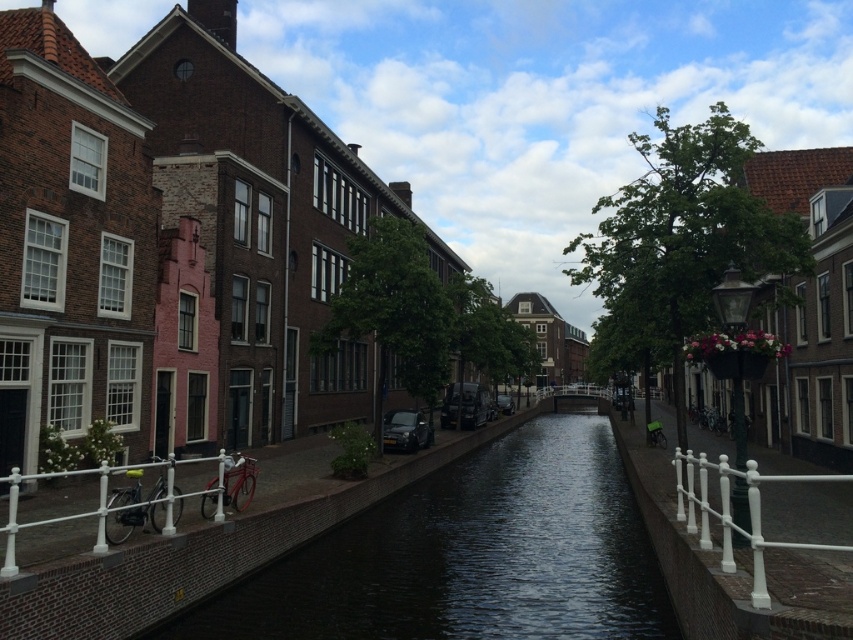
Question: Does white metal railing at lower right have a larger size compared to metallic bicycle at lower left?

Choices:
 (A) no
 (B) yes

Answer: (B)

Question: Among these points, which one is farthest from the camera?

Choices:
 (A) (701, 534)
 (B) (93, 509)

Answer: (B)

Question: Does white metal railing at lower right appear under metallic bicycle at lower left?

Choices:
 (A) yes
 (B) no

Answer: (A)

Question: Which object appears farthest from the camera in this image?

Choices:
 (A) metallic bicycle at lower left
 (B) white metal railing at lower right

Answer: (A)

Question: Which of the following is the farthest from the observer?

Choices:
 (A) (753, 582)
 (B) (90, 513)

Answer: (B)

Question: Observing the image, what is the correct spatial positioning of white metal railing at lower right in reference to metallic bicycle at lower left?

Choices:
 (A) above
 (B) below

Answer: (B)